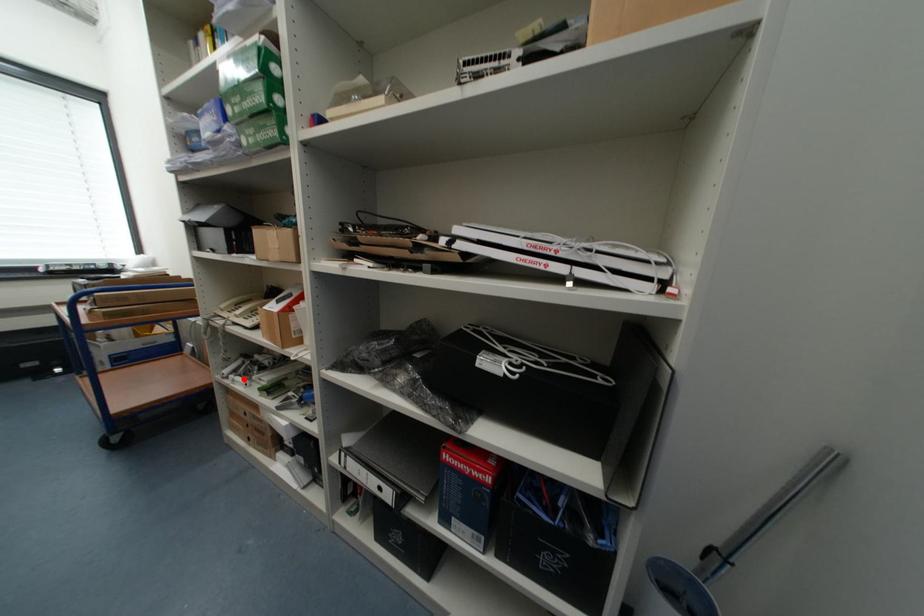
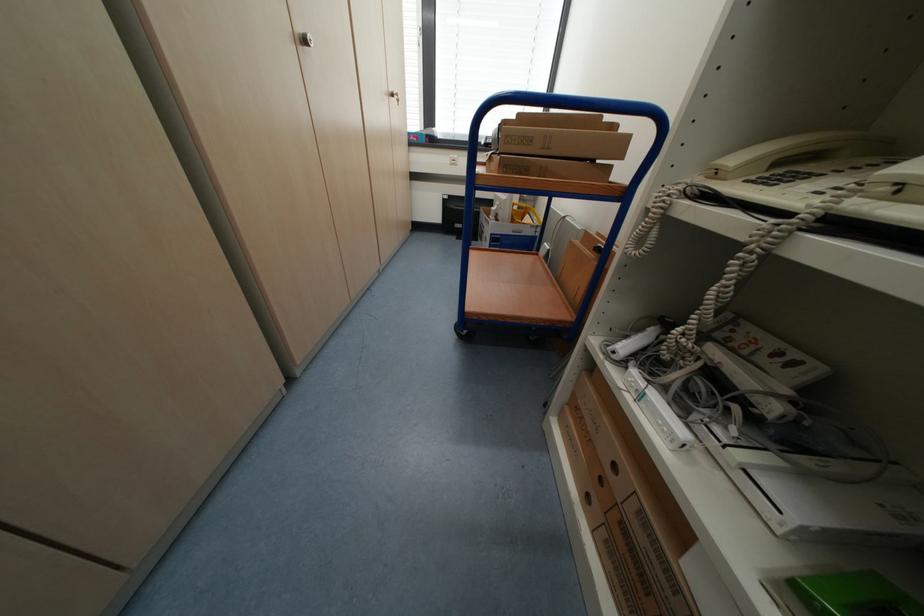
Where in the second image is the point corresponding to the highlighted location from the first image?

(662, 398)